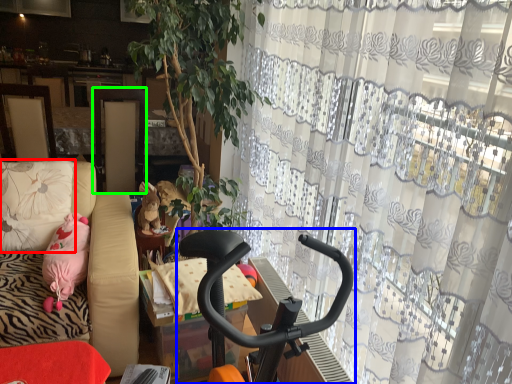
Question: Considering the real-world distances, which object is closest to pillow (highlighted by a red box)? baby carriage (highlighted by a blue box) or screen door (highlighted by a green box).

Choices:
 (A) baby carriage
 (B) screen door

Answer: (B)